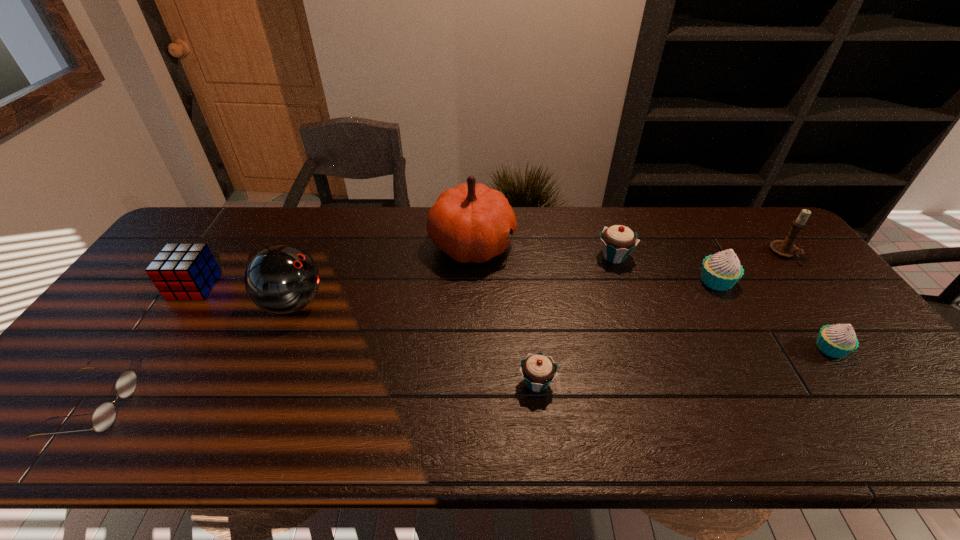
Find the location of a particular element. free space between the nearest cupcake and the candle holder is located at coordinates (660, 318).

This screenshot has height=540, width=960. Find the location of `free space between the bigger white cupcake and the spectacles`. free space between the bigger white cupcake and the spectacles is located at coordinates (405, 345).

The image size is (960, 540). Identify the location of free space between the cube and the left teal cupcake. (366, 335).

Where is `vacant area between the farther teal cupcake and the nearer teal cupcake`? vacant area between the farther teal cupcake and the nearer teal cupcake is located at coordinates (575, 320).

I want to click on blank region between the nearer teal cupcake and the third farthest cupcake, so click(x=684, y=366).

Where is `free space between the shortest object and the nearer teal cupcake`? The image size is (960, 540). free space between the shortest object and the nearer teal cupcake is located at coordinates (315, 395).

This screenshot has width=960, height=540. I want to click on empty location between the candle holder and the seventh object from right to left, so click(x=540, y=279).

At what (x,y) coordinates should I click in order to perform the action: click on vacant point located between the bigger white cupcake and the right teal cupcake. Please return your answer as a coordinate pair (x, y). The height and width of the screenshot is (540, 960). Looking at the image, I should click on (665, 269).

The image size is (960, 540). I want to click on free spot between the black bowling ball and the red cube, so click(x=244, y=295).

The image size is (960, 540). I want to click on free space between the farther white cupcake and the black bowling ball, so click(x=505, y=292).